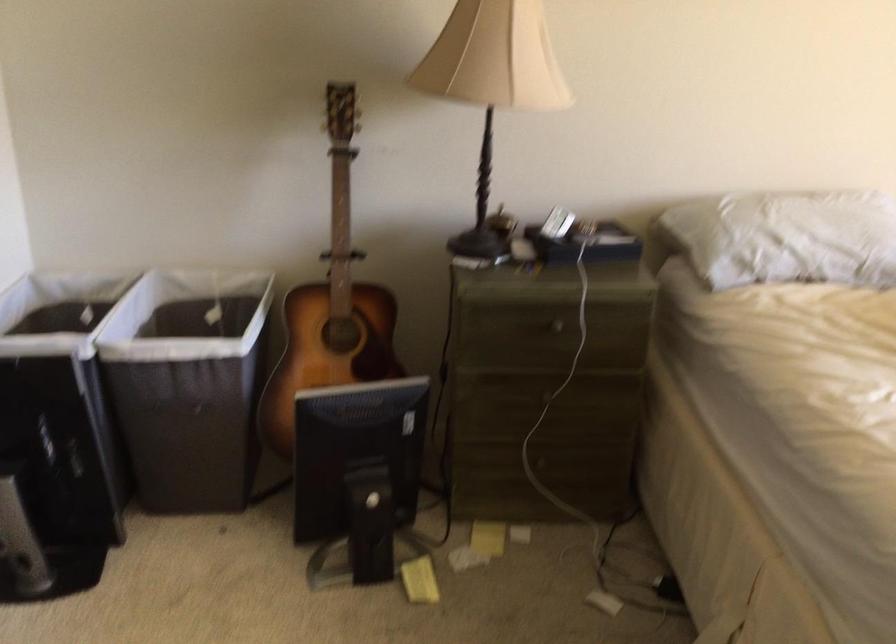
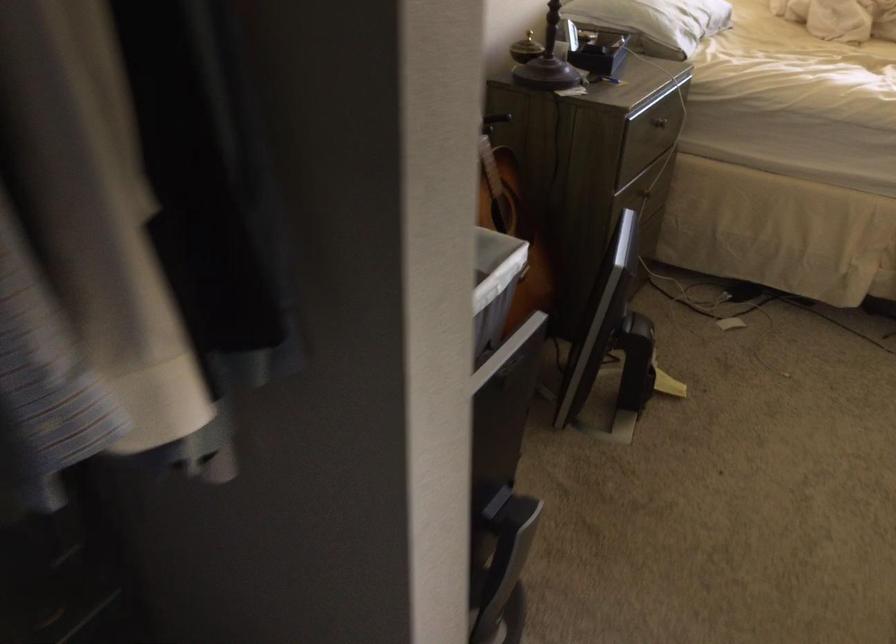
Question: I am providing you with two images of the same scene from different viewpoints. Please identify which objects are invisible in image2.

Choices:
 (A) clear plastic organizer
 (B) drawer knob
 (C) white pillow
 (D) acoustic guitar

Answer: (D)